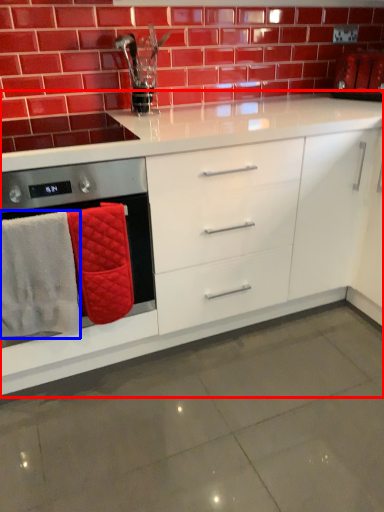
Question: Among these objects, which one is nearest to the camera, cabinetry (highlighted by a red box) or bath towel (highlighted by a blue box)?

Choices:
 (A) cabinetry
 (B) bath towel

Answer: (A)